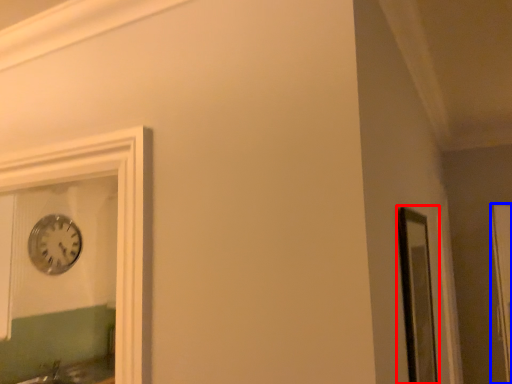
Question: Which object is closer to the camera taking this photo, window frame (highlighted by a red box) or glass door (highlighted by a blue box)?

Choices:
 (A) window frame
 (B) glass door

Answer: (A)